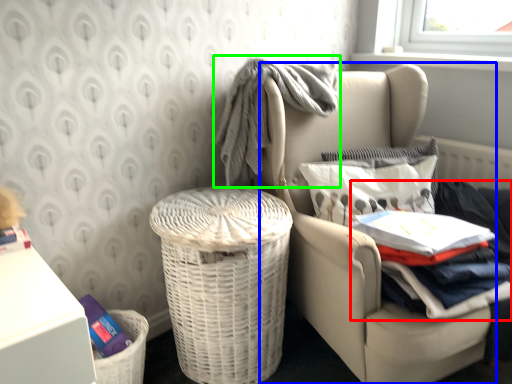
Question: Estimate the real-world distances between objects in this image. Which object is farther from clothing (highlighted by a red box), chair (highlighted by a blue box) or baby clothe (highlighted by a green box)?

Choices:
 (A) chair
 (B) baby clothe

Answer: (B)